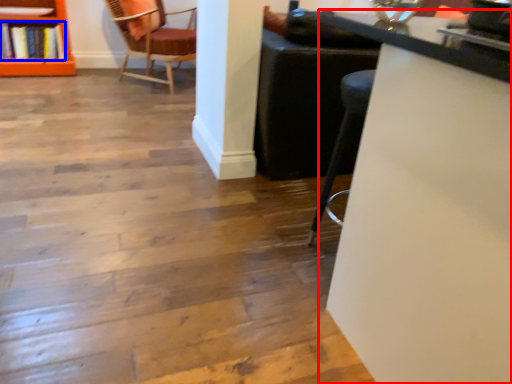
Question: Which object is closer to the camera taking this photo, table (highlighted by a red box) or book (highlighted by a blue box)?

Choices:
 (A) table
 (B) book

Answer: (A)